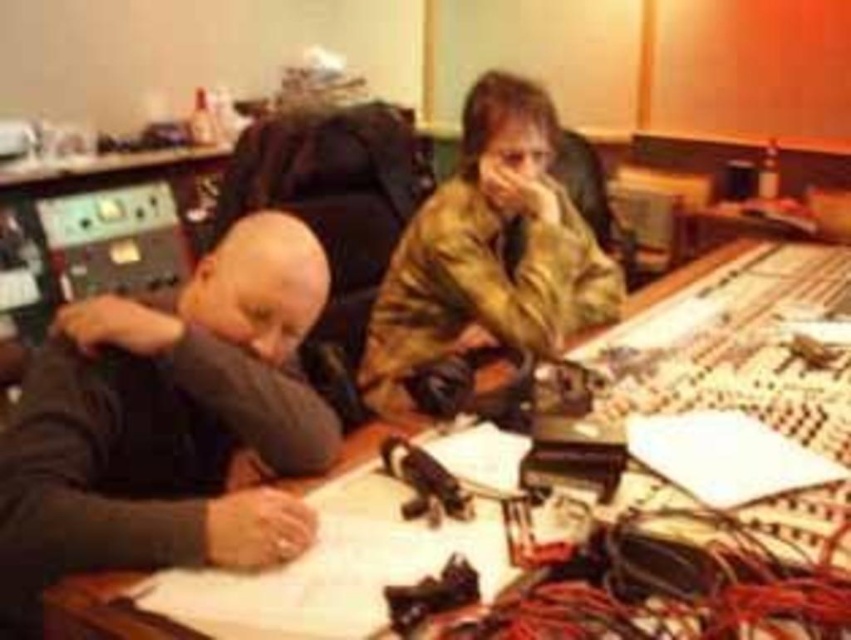
Question: Which object appears farthest from the camera in this image?

Choices:
 (A) camouflage jacket at center
 (B) white paper at center

Answer: (A)

Question: Estimate the real-world distances between objects in this image. Which object is closer to the camouflage jacket at center?

Choices:
 (A) dark gray sweater at left
 (B) white paper at center

Answer: (B)

Question: Is white paper at center positioned in front of dark gray sweater at left?

Choices:
 (A) no
 (B) yes

Answer: (B)

Question: Is white paper at center further to the viewer compared to dark gray sweater at left?

Choices:
 (A) yes
 (B) no

Answer: (B)

Question: Which object is farther from the camera taking this photo?

Choices:
 (A) camouflage jacket at center
 (B) white paper at center
 (C) dark gray sweater at left

Answer: (A)

Question: Is dark gray sweater at left below camouflage jacket at center?

Choices:
 (A) yes
 (B) no

Answer: (A)